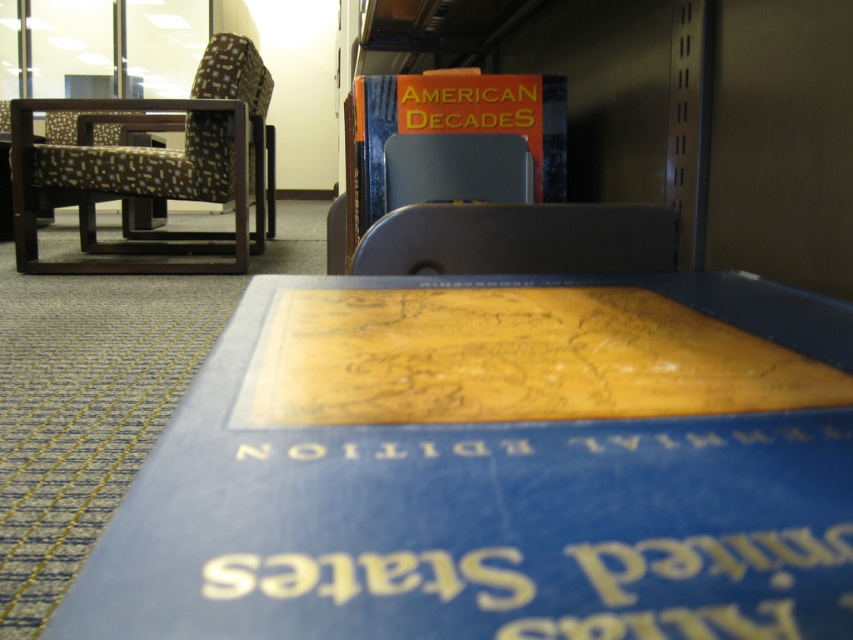
Question: Can you confirm if blue matte map at lower right is positioned below brown fabric chair at left?

Choices:
 (A) yes
 (B) no

Answer: (A)

Question: From the image, what is the correct spatial relationship of blue matte map at lower right in relation to brown fabric chair at left?

Choices:
 (A) left
 (B) right

Answer: (B)

Question: Which object is positioned closest to the orange matte book at upper center?

Choices:
 (A) matte plastic chair at center
 (B) brown fabric chair at left

Answer: (A)

Question: Among these points, which one is nearest to the camera?

Choices:
 (A) (97, 195)
 (B) (596, 524)

Answer: (B)

Question: Is brown fabric chair at left closer to camera compared to matte plastic chair at center?

Choices:
 (A) yes
 (B) no

Answer: (B)

Question: Which point is farther to the camera?

Choices:
 (A) orange matte book at upper center
 (B) brown fabric chair at left
 (C) matte plastic chair at center

Answer: (B)